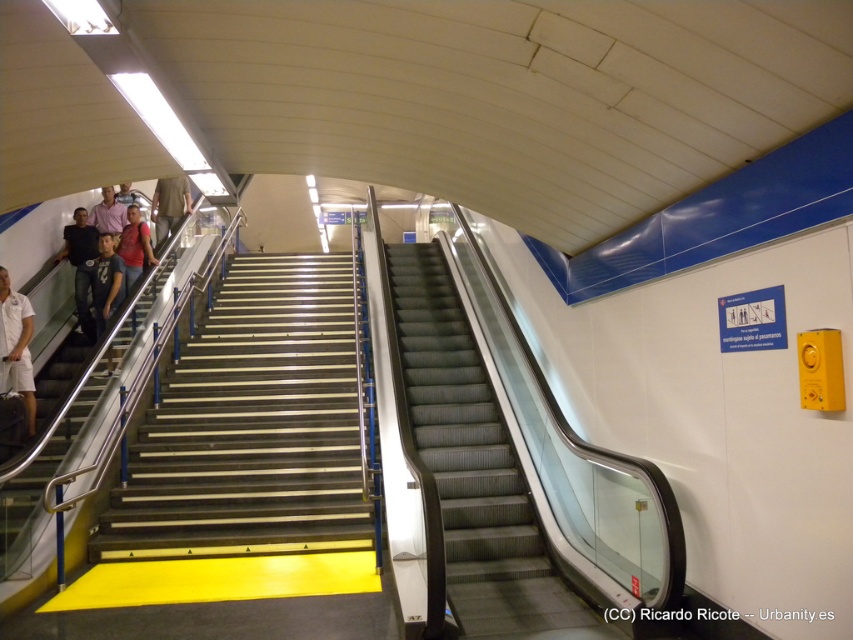
You are standing at the bottom of the stairs in the subway station. You see two points marked in the scene. Which point, point (x=566, y=616) or point (x=149, y=337), is closer to you?

Point (x=566, y=616) is closer to the viewer than point (x=149, y=337).

You are standing in the subway station and want to reach the information desk located at point (496, 624). If your wheelchair has a turning radius of 1.2 meters, can you navigate to that point from your current position?

The point (496, 624) is 3.89 meters away from you. Since your wheelchair requires a turning radius of 1.2 meters, and the distance is sufficient, you can navigate to that point as long as there are no obstacles in the path.

You are a maintenance worker needing to inspect the black rubber stairs at right. The safety protocol requires you to stay within 5 meters of the stairs at all times. Can you safely perform your inspection without moving beyond the required distance?

The black rubber stairs at right are 4.96 meters apart. Since 4.96 meters is less than 5 meters, you can safely perform your inspection without moving beyond the required distance.